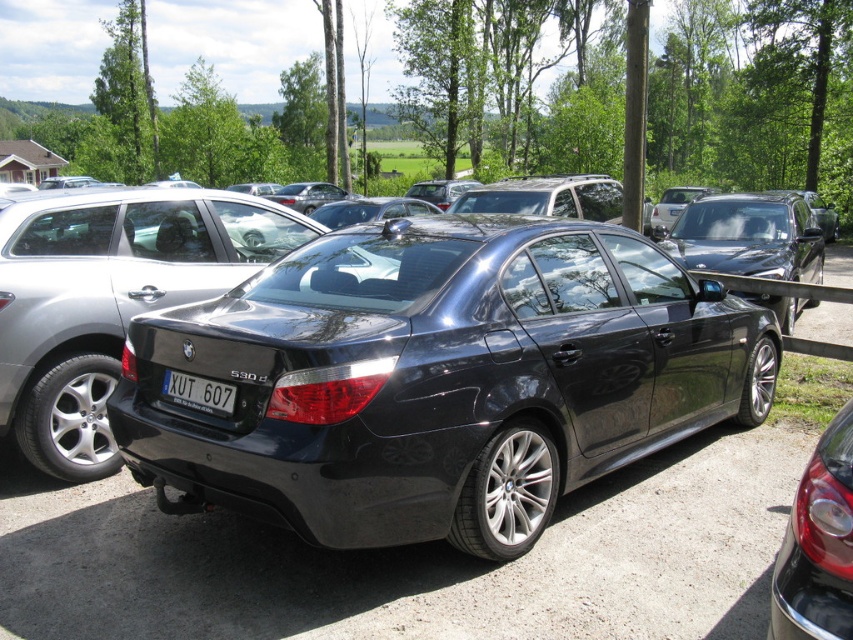
Is glossy black car at center to the left of glossy black sedan at center from the viewer's perspective?

Correct, you'll find glossy black car at center to the left of glossy black sedan at center.

Does glossy black car at center have a smaller size compared to glossy black sedan at center?

Correct, glossy black car at center occupies less space than glossy black sedan at center.

Find the location of `glossy black car at center`. glossy black car at center is located at coordinates (817, 545).

Locate an element on the screen. The image size is (853, 640). glossy black car at center is located at coordinates (817, 545).

Can you confirm if glossy black sedan at center is positioned above white plastic license plate at rear?

Indeed, glossy black sedan at center is positioned over white plastic license plate at rear.

This screenshot has width=853, height=640. Find the location of `glossy black sedan at center`. glossy black sedan at center is located at coordinates (747, 236).

Is glossy black car at center taller than white plastic license plate at rear?

Correct, glossy black car at center is much taller as white plastic license plate at rear.

Is glossy black car at center behind white plastic license plate at rear?

That is False.

Is point (775, 612) in front of point (189, 394)?

Yes, point (775, 612) is in front of point (189, 394).

Where is `glossy black car at center`? glossy black car at center is located at coordinates (817, 545).